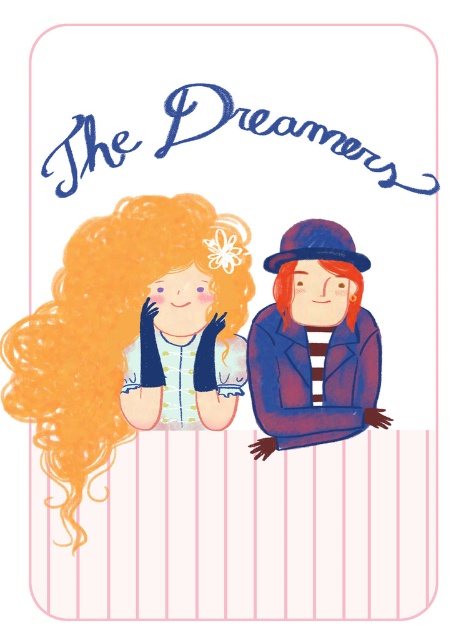
Question: Does matte blue hat at center appear under blonde curly hair at center?

Choices:
 (A) no
 (B) yes

Answer: (B)

Question: Which of the following is the closest to the observer?

Choices:
 (A) golden curly hair at left
 (B) blonde curly hair at center

Answer: (A)

Question: Is matte blue hat at center positioned in front of blonde curly hair at center?

Choices:
 (A) yes
 (B) no

Answer: (A)

Question: Does matte blue hat at center appear on the right side of blonde curly hair at center?

Choices:
 (A) yes
 (B) no

Answer: (A)

Question: Which of these objects is positioned closest to the blonde curly hair at center?

Choices:
 (A) golden curly hair at left
 (B) matte blue hat at center

Answer: (B)

Question: Which of the following is the closest to the observer?

Choices:
 (A) golden curly hair at left
 (B) matte blue hat at center

Answer: (A)